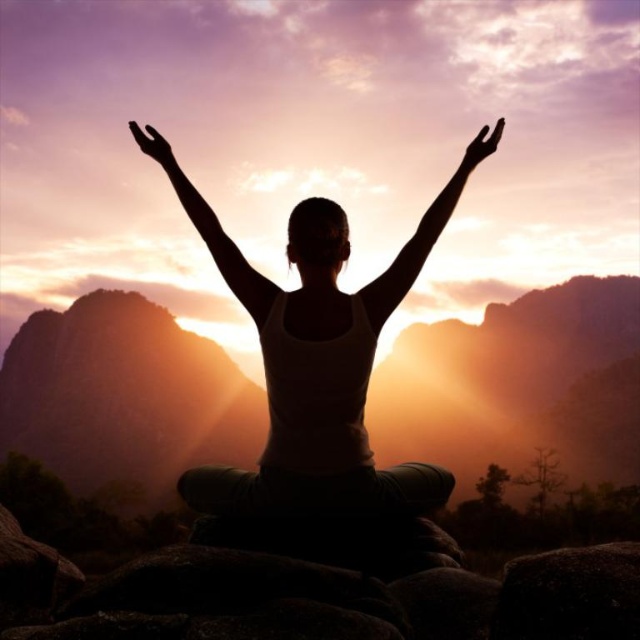
You are a photographer trying to capture the silhouette of the person and the rock in the scene. Given that the matte brown rock at center is larger than the silhouette arm at center, which object should you focus on to ensure the silhouette is more prominent in the photo?

The matte brown rock at center has a larger size compared to the silhouette arm at center, so focusing on the matte brown rock at center will result in a more prominent silhouette in the photo.

You are standing in the scene and want to place a small flag exactly at the center of the matte brown rock at center. According to the coordinates provided, where should you place the flag?

The flag should be placed at the coordinates point (515,385), which is the 2D location of the matte brown rock at center.